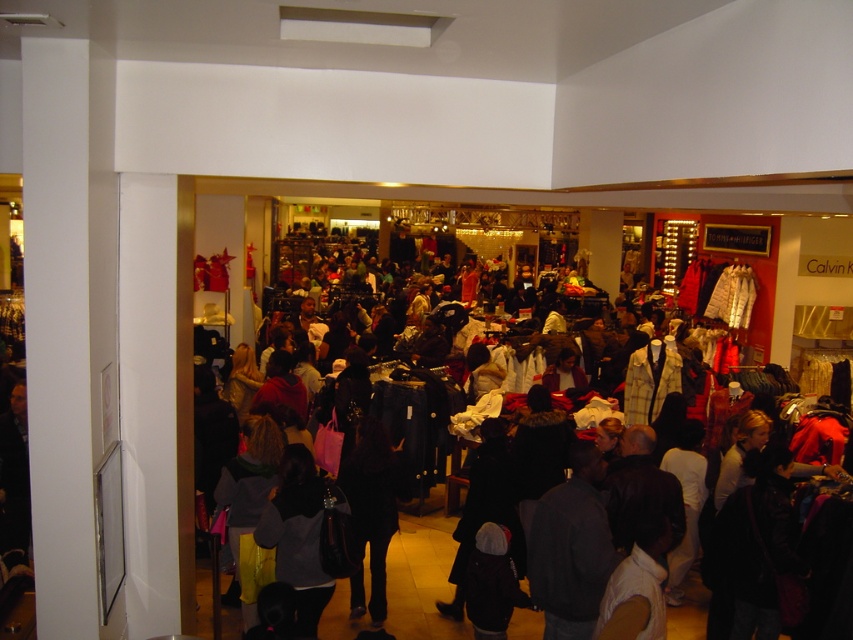
Question: Is dark gray fabric jacket at center bigger than white cotton pants at center?

Choices:
 (A) no
 (B) yes

Answer: (B)

Question: Which object is farther from the camera taking this photo?

Choices:
 (A) white cotton pants at center
 (B) dark gray sweater at lower center
 (C) dark gray fabric jacket at center

Answer: (A)

Question: Which of the following is the farthest from the observer?

Choices:
 (A) white cotton shirt at center
 (B) black fabric pants at center

Answer: (A)

Question: Does dark gray fabric jacket at center come in front of yellow plaid jacket at center?

Choices:
 (A) yes
 (B) no

Answer: (A)

Question: Can you confirm if white cotton shirt at center is positioned above dark gray sweater at lower center?

Choices:
 (A) yes
 (B) no

Answer: (A)

Question: Which point is farther to the camera?

Choices:
 (A) white cotton pants at center
 (B) dark gray fabric jacket at center
 (C) black fabric pants at center
 (D) dark gray sweater at lower center

Answer: (A)